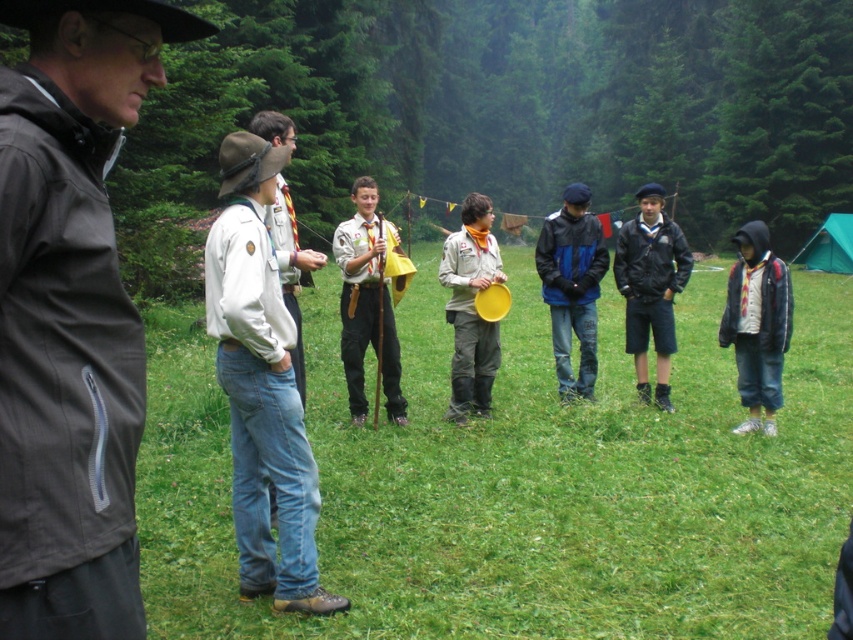
Can you confirm if white uniform at center is positioned to the left of matte gray hoodie at right?

Correct, you'll find white uniform at center to the left of matte gray hoodie at right.

Can you confirm if white uniform at center is thinner than matte gray hoodie at right?

No.

What do you see at coordinates (260, 385) in the screenshot?
I see `white uniform at center` at bounding box center [260, 385].

Locate an element on the screen. The image size is (853, 640). white uniform at center is located at coordinates (260, 385).

Which is below, dark brown jacket at left or matte yellow frisbee at center?

matte yellow frisbee at center is below.

Is point (141, 24) positioned after point (468, 323)?

No, (141, 24) is closer to viewer.

Is point (28, 380) less distant than point (488, 371)?

Yes, it is.

The image size is (853, 640). Identify the location of dark brown jacket at left. (71, 316).

Does matte yellow frisbee at center have a greater height compared to green canvas tent at right?

In fact, matte yellow frisbee at center may be shorter than green canvas tent at right.

Which is above, matte yellow frisbee at center or green canvas tent at right?

green canvas tent at right is higher up.

Image resolution: width=853 pixels, height=640 pixels. Describe the element at coordinates (471, 308) in the screenshot. I see `matte yellow frisbee at center` at that location.

Image resolution: width=853 pixels, height=640 pixels. In order to click on matte yellow frisbee at center in this screenshot , I will do `click(471, 308)`.